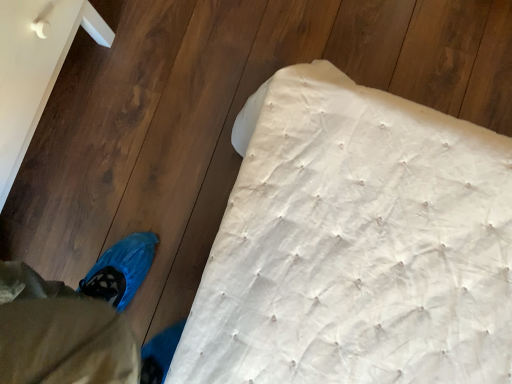
Question: Should I look upward or downward to see white quilted mattress at lower right?

Choices:
 (A) down
 (B) up

Answer: (B)

Question: Is white quilted mattress at lower right wider than blue fabric bag at lower left?

Choices:
 (A) yes
 (B) no

Answer: (A)

Question: Can we say white quilted mattress at lower right lies outside blue fabric bag at lower left?

Choices:
 (A) no
 (B) yes

Answer: (B)

Question: Considering the relative sizes of white quilted mattress at lower right and blue fabric bag at lower left in the image provided, is white quilted mattress at lower right shorter than blue fabric bag at lower left?

Choices:
 (A) yes
 (B) no

Answer: (A)

Question: Does white quilted mattress at lower right have a lesser width compared to blue fabric bag at lower left?

Choices:
 (A) yes
 (B) no

Answer: (B)

Question: From a real-world perspective, is white quilted mattress at lower right below blue fabric bag at lower left?

Choices:
 (A) yes
 (B) no

Answer: (A)

Question: Does white quilted mattress at lower right appear on the right side of blue fabric bag at lower left?

Choices:
 (A) yes
 (B) no

Answer: (A)

Question: From a real-world perspective, is blue fabric bag at lower left physically below white quilted mattress at lower right?

Choices:
 (A) yes
 (B) no

Answer: (B)

Question: Does blue fabric bag at lower left have a lesser height compared to white quilted mattress at lower right?

Choices:
 (A) yes
 (B) no

Answer: (B)

Question: Can you confirm if blue fabric bag at lower left is bigger than white quilted mattress at lower right?

Choices:
 (A) yes
 (B) no

Answer: (B)

Question: From a real-world perspective, does blue fabric bag at lower left stand above white quilted mattress at lower right?

Choices:
 (A) yes
 (B) no

Answer: (A)

Question: Is blue fabric bag at lower left far from white quilted mattress at lower right?

Choices:
 (A) no
 (B) yes

Answer: (A)

Question: Can you confirm if blue fabric bag at lower left is wider than white quilted mattress at lower right?

Choices:
 (A) no
 (B) yes

Answer: (A)

Question: In the image, is blue fabric bag at lower left positioned in front of or behind white quilted mattress at lower right?

Choices:
 (A) front
 (B) behind

Answer: (A)